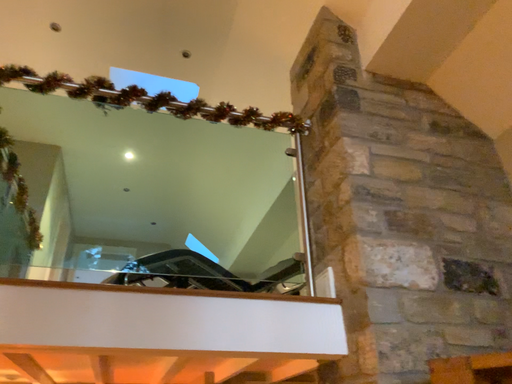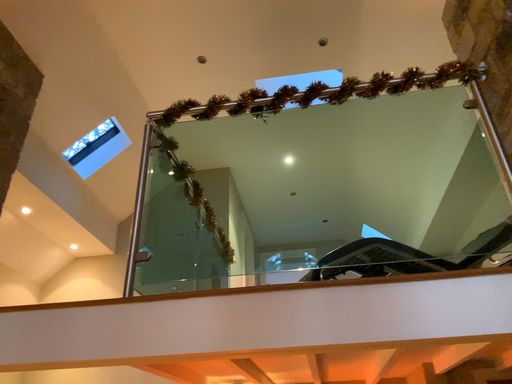
Question: Which way did the camera rotate in the video?

Choices:
 (A) rotated left
 (B) rotated right

Answer: (A)